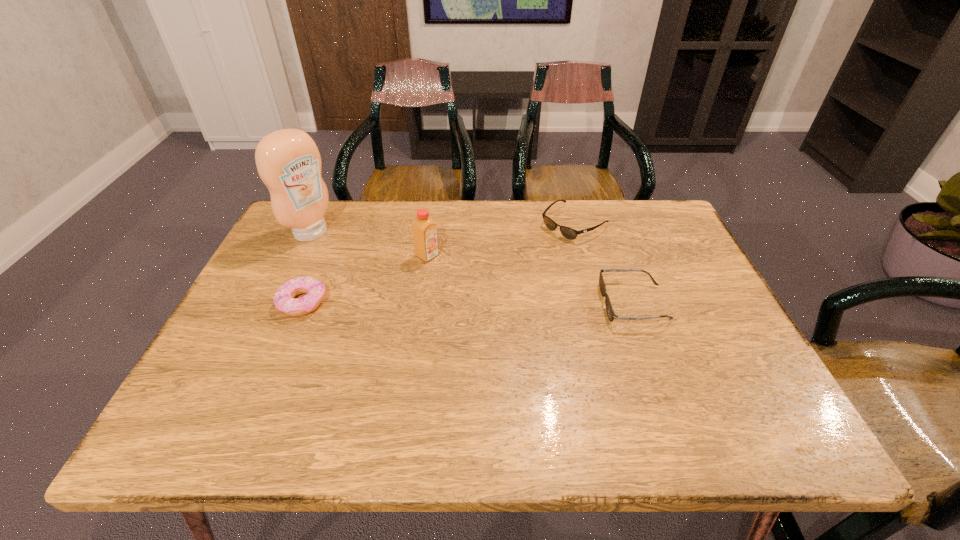
You are a GUI agent. You are given a task and a screenshot of the screen. Output one action in this format:
    pyautogui.click(x=<x>, y=<y>)
    Task: Click on the doughnut
    The width and height of the screenshot is (960, 540).
    Given the screenshot: What is the action you would take?
    pyautogui.click(x=314, y=289)

Locate an element on the screen. Image resolution: width=960 pixels, height=540 pixels. the nearer sunglasses is located at coordinates (611, 315).

This screenshot has height=540, width=960. In order to click on orange juice in this screenshot , I will do `click(424, 229)`.

This screenshot has width=960, height=540. Find the location of `the fourth shortest object`. the fourth shortest object is located at coordinates (424, 229).

Locate an element on the screen. The height and width of the screenshot is (540, 960). the farther sunglasses is located at coordinates (569, 233).

Find the location of a particular element. The width and height of the screenshot is (960, 540). the tallest object is located at coordinates (288, 161).

The width and height of the screenshot is (960, 540). What are the coordinates of `vacant space located 0.190m on the right of the doughnut` in the screenshot? It's located at (405, 302).

Locate an element on the screen. The height and width of the screenshot is (540, 960). vacant area situated 0.110m on the front-facing side of the nearer sunglasses is located at coordinates coord(557,303).

I want to click on free space located 0.280m on the front-facing side of the nearer sunglasses, so click(x=487, y=303).

This screenshot has width=960, height=540. I want to click on vacant region located 0.100m on the front-facing side of the nearer sunglasses, so click(x=561, y=303).